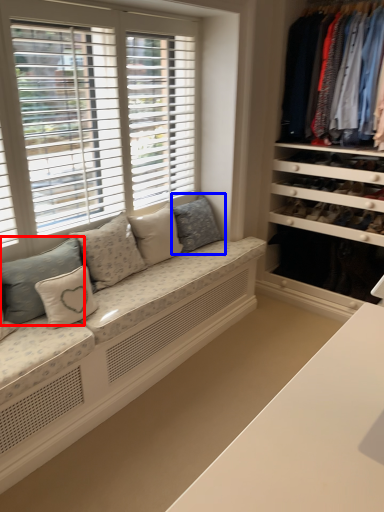
Question: Which object is closer to the camera taking this photo, pillow (highlighted by a red box) or pillow (highlighted by a blue box)?

Choices:
 (A) pillow
 (B) pillow

Answer: (A)